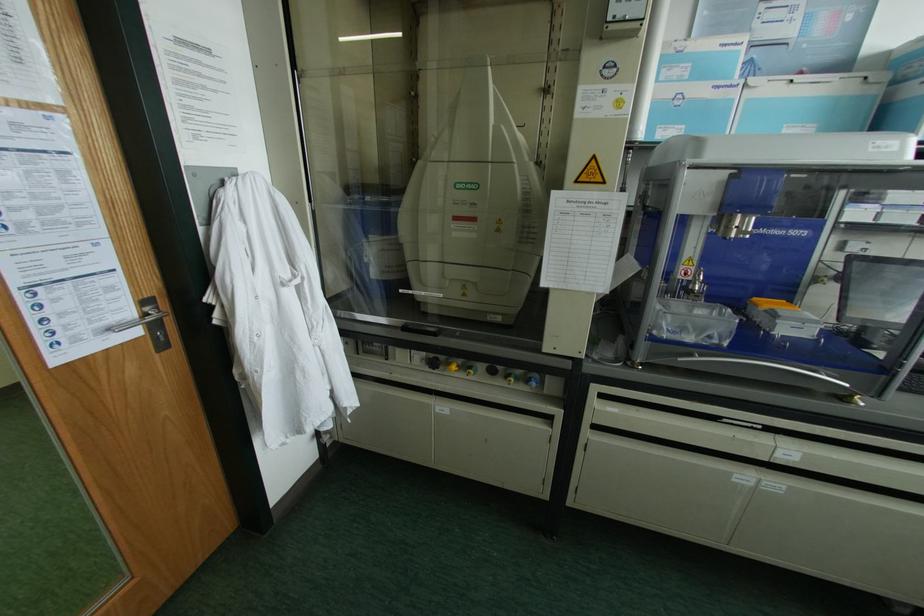
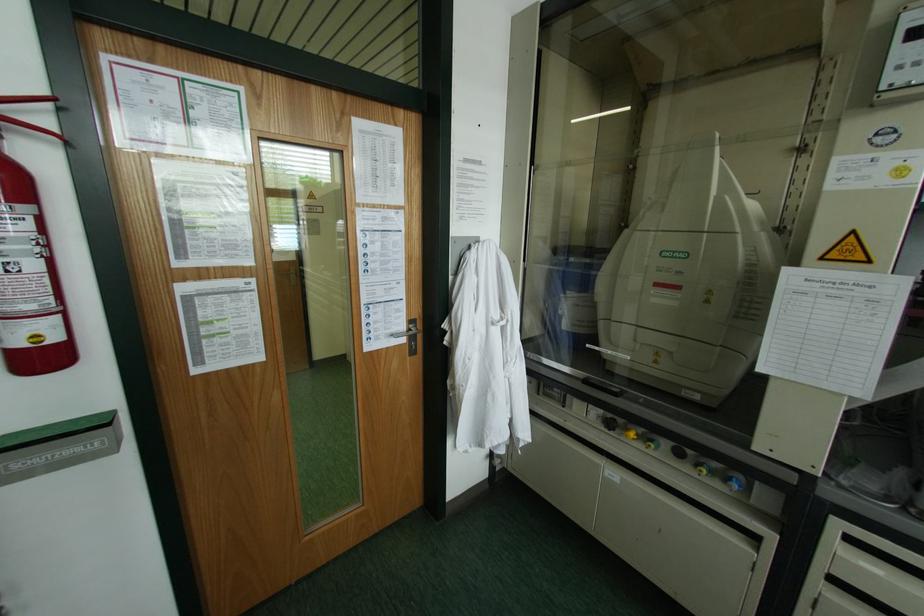
The point at (x=142, y=302) is marked in the first image. Where is the corresponding point in the second image?

(409, 321)